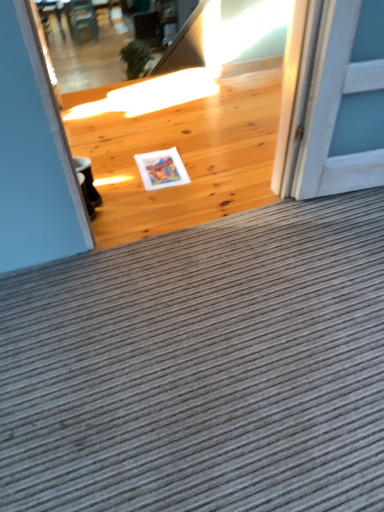
This screenshot has height=512, width=384. I want to click on free space above white matte postcard at center (from a real-world perspective), so click(162, 162).